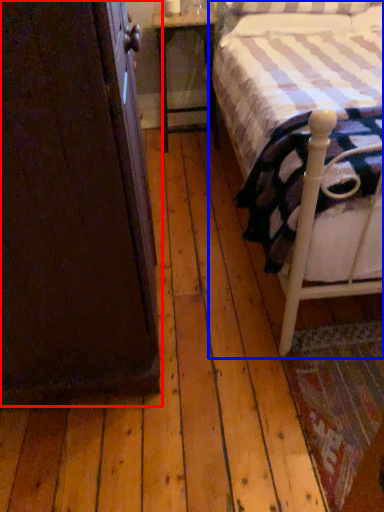
Question: Which of the following is the closest to the observer, armoire (highlighted by a red box) or bed (highlighted by a blue box)?

Choices:
 (A) armoire
 (B) bed

Answer: (A)